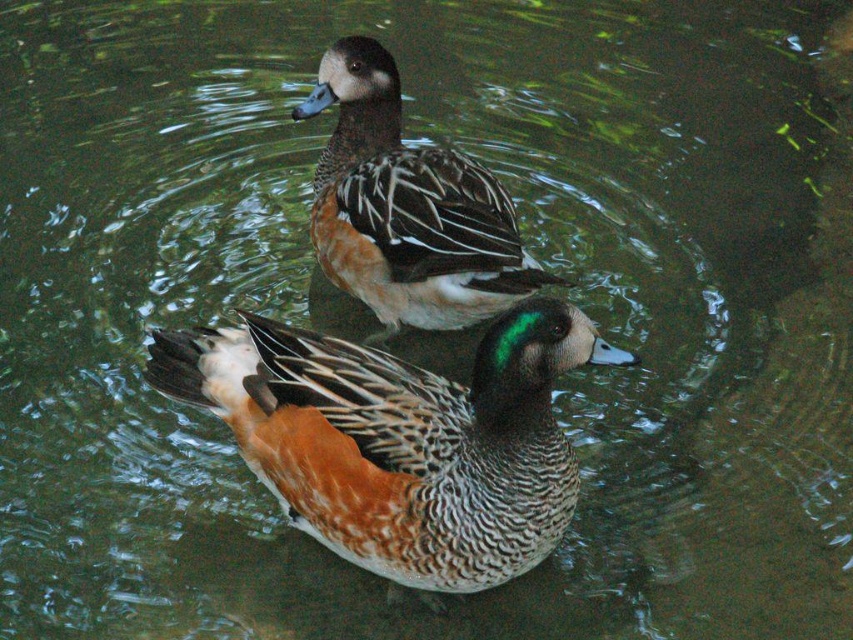
Does point (483, 388) come farther from viewer compared to point (433, 296)?

No, (483, 388) is closer to viewer.

Is speckled brown duck at center taller than brown speckled duck at upper center?

Incorrect, speckled brown duck at center's height is not larger of brown speckled duck at upper center's.

Identify the location of speckled brown duck at center. This screenshot has width=853, height=640. (399, 438).

In order to click on speckled brown duck at center in this screenshot , I will do `click(399, 438)`.